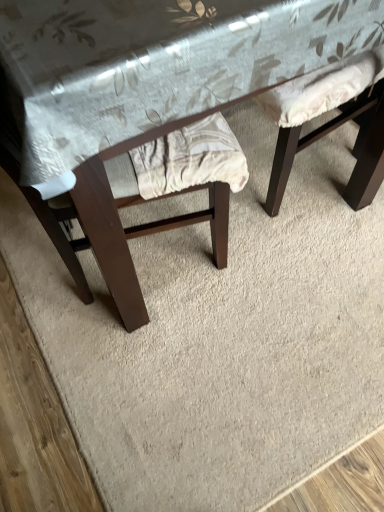
Question: In the image, is matte fabric swivel chair at upper right on the left side or the right side of wooden table at center?

Choices:
 (A) left
 (B) right

Answer: (B)

Question: From their relative heights in the image, would you say matte fabric swivel chair at upper right is taller or shorter than wooden table at center?

Choices:
 (A) short
 (B) tall

Answer: (A)

Question: Choose the correct answer: Is matte fabric swivel chair at upper right inside wooden table at center or outside it?

Choices:
 (A) inside
 (B) outside

Answer: (A)

Question: From their relative heights in the image, would you say wooden table at center is taller or shorter than matte fabric swivel chair at upper right?

Choices:
 (A) tall
 (B) short

Answer: (A)

Question: From a real-world perspective, is wooden table at center above or below matte fabric swivel chair at upper right?

Choices:
 (A) above
 (B) below

Answer: (A)

Question: Considering their positions, is wooden table at center located in front of or behind matte fabric swivel chair at upper right?

Choices:
 (A) front
 (B) behind

Answer: (A)

Question: Is wooden table at center to the left or to the right of matte fabric swivel chair at upper right in the image?

Choices:
 (A) left
 (B) right

Answer: (A)